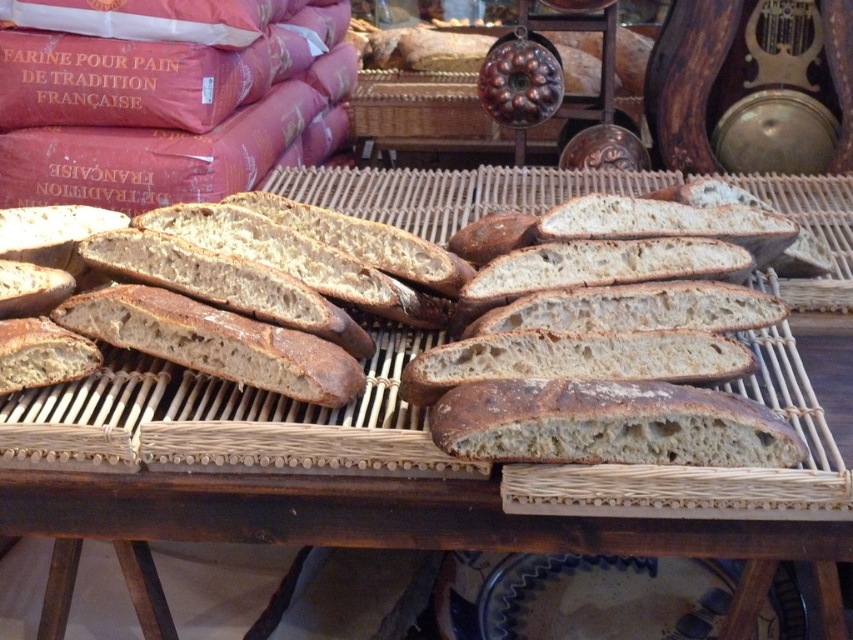
Who is taller, brown matte baguette at center or brown crusty loaf of bread at center?

brown matte baguette at center

Is brown matte baguette at center smaller than brown crusty loaf of bread at center?

No.

Does point (97, 388) come in front of point (717, 432)?

No, (97, 388) is further to viewer.

Identify the location of brown matte baguette at center. (223, 420).